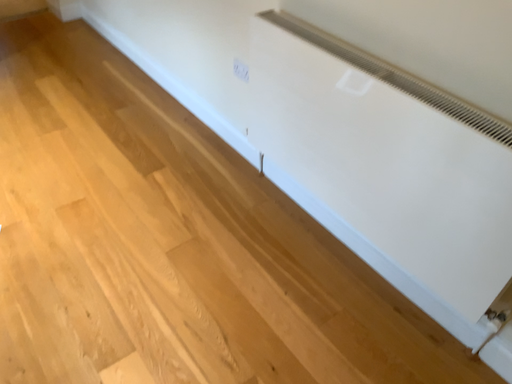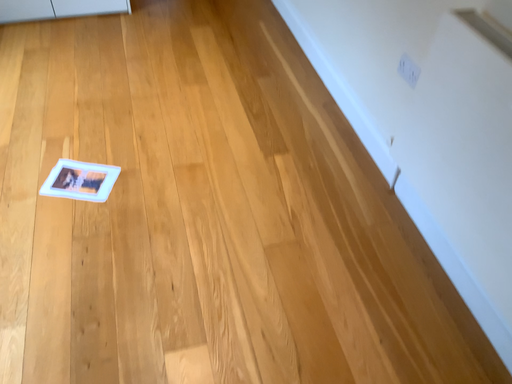
Question: Which way did the camera rotate in the video?

Choices:
 (A) rotated right
 (B) rotated left

Answer: (B)